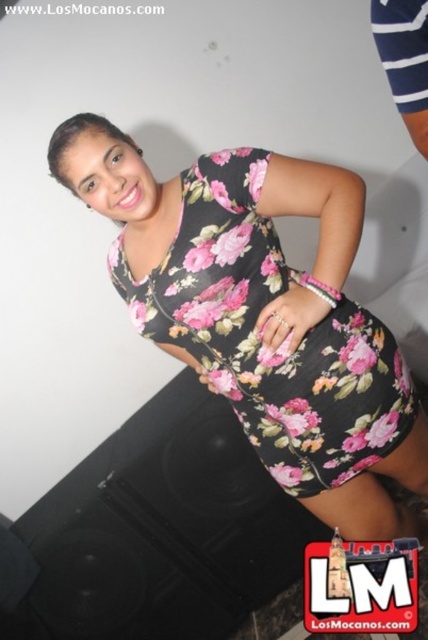
How far apart are floral print fabric dress at center and white striped fabric at upper right?

floral print fabric dress at center and white striped fabric at upper right are 47.83 centimeters apart.

Is floral print fabric dress at center to the left of white striped fabric at upper right from the viewer's perspective?

Indeed, floral print fabric dress at center is positioned on the left side of white striped fabric at upper right.

Between point (139, 292) and point (421, 60), which one is positioned behind?

Point (139, 292)

You are a GUI agent. You are given a task and a screenshot of the screen. Output one action in this format:
    pyautogui.click(x=<x>, y=<y>)
    Task: Click on the floral print fabric dress at center
    Image resolution: width=428 pixels, height=640 pixels.
    Given the screenshot: What is the action you would take?
    pyautogui.click(x=259, y=339)